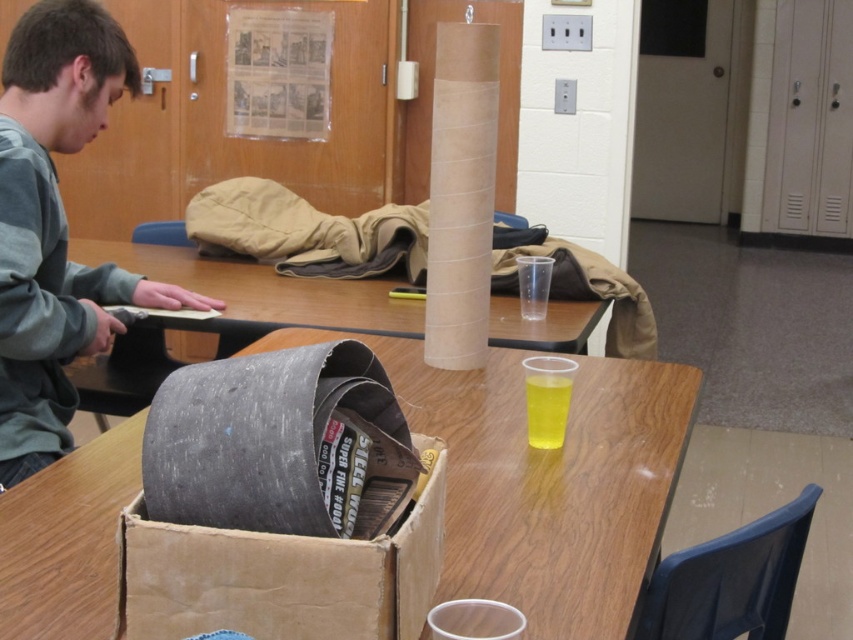
You need to place a new item on the table in the image. Given that the brown cardboard box at center is currently taking up less space than the wooden table at center, where would you place the new item to ensure it doesn not get in the way of the existing items?

Since the brown cardboard box at center occupies less space than the wooden table at center, there is still ample space on the wooden table at center to place the new item without disturbing the existing items.

You are organizing items on the table and need to stack the brown cardboard box at center on top of the wooden table at center. Is this possible based on their dimensions?

The brown cardboard box at center is thinner than the wooden table at center, so it can be stacked on top as long as the table is sturdy enough to support it.